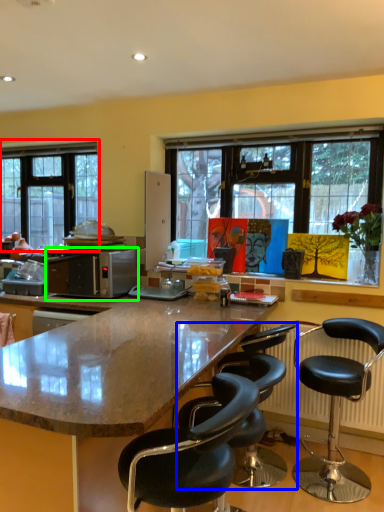
Question: Considering the real-world distances, which object is closest to window (highlighted by a red box)? chair (highlighted by a blue box) or microwave oven (highlighted by a green box).

Choices:
 (A) chair
 (B) microwave oven

Answer: (B)